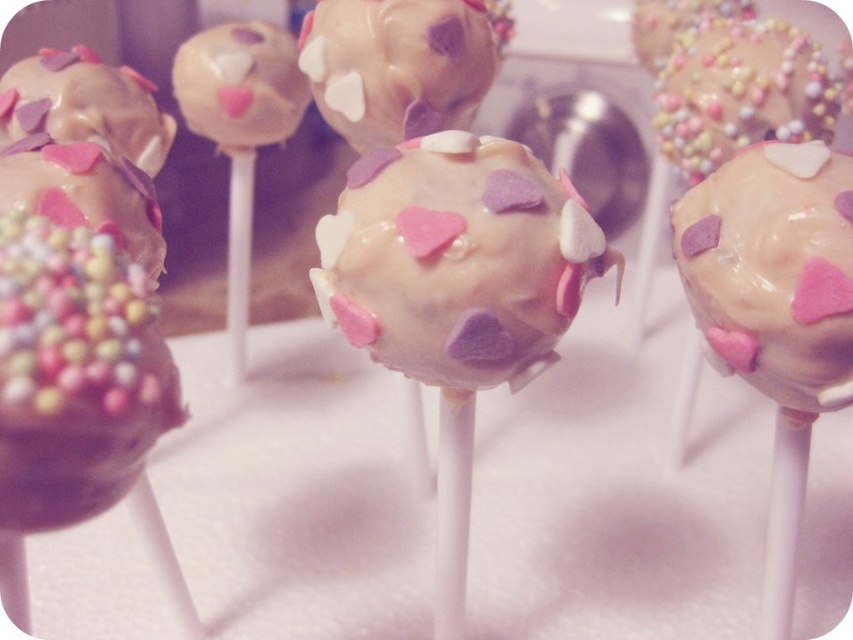
Question: Which of these objects is positioned closest to the matte white cake pop at center?

Choices:
 (A) chocolate-coated cake pop at left
 (B) matte white cake pop at right
 (C) white glossy cake pop at center

Answer: (C)

Question: From the image, what is the correct spatial relationship of matte white cake pop at right in relation to matte chocolate cake pop at left?

Choices:
 (A) below
 (B) above

Answer: (A)

Question: Which point is closer to the camera?

Choices:
 (A) matte chocolate cake pop at left
 (B) matte white cake pop at right
 (C) chocolate-coated cake pop at left
 (D) glazed chocolate cake pop at upper right

Answer: (C)

Question: Which is farther from the white glossy cake pop at center?

Choices:
 (A) chocolate-coated cake pop at left
 (B) matte chocolate cake pop at left
 (C) matte white cake pop at center

Answer: (B)

Question: Is matte white cake pop at center positioned behind matte chocolate cake pop at left?

Choices:
 (A) no
 (B) yes

Answer: (A)

Question: In this image, where is chocolate-coated cake pop at left located relative to glazed chocolate cake pop at upper right?

Choices:
 (A) below
 (B) above

Answer: (A)